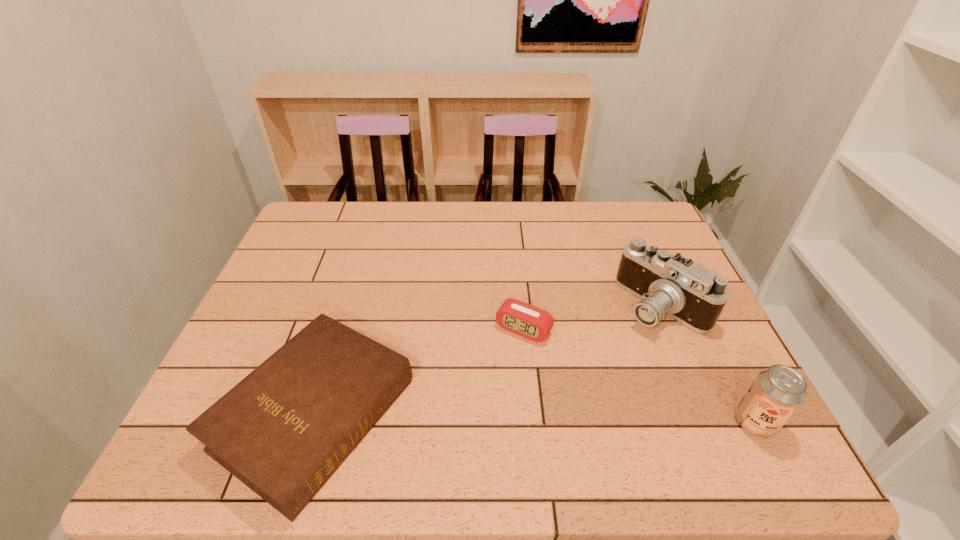
The height and width of the screenshot is (540, 960). I want to click on the leftmost object, so click(x=283, y=430).

This screenshot has height=540, width=960. What are the coordinates of `Bible` in the screenshot? It's located at (283, 430).

Find the location of a particular element. The height and width of the screenshot is (540, 960). beer can is located at coordinates (777, 392).

Where is `alarm clock`? Image resolution: width=960 pixels, height=540 pixels. alarm clock is located at coordinates (523, 319).

The image size is (960, 540). What are the coordinates of `the shortest object` in the screenshot? It's located at (523, 319).

You are a GUI agent. You are given a task and a screenshot of the screen. Output one action in this format:
    pyautogui.click(x=<x>, y=<y>)
    Task: Click on the camera
    
    Given the screenshot: What is the action you would take?
    pyautogui.click(x=688, y=292)

Image resolution: width=960 pixels, height=540 pixels. Find the location of `free space located 0.200m on the back of the leftmost object`. free space located 0.200m on the back of the leftmost object is located at coordinates (356, 282).

Locate an element on the screen. free spot located 0.160m on the back of the beer can is located at coordinates (716, 347).

In order to click on blank area located on the front-facing side of the second object from left to right in this screenshot , I will do `click(496, 367)`.

The width and height of the screenshot is (960, 540). In order to click on vacant space located 0.120m on the front-facing side of the second object from left to right in this screenshot , I will do `click(488, 380)`.